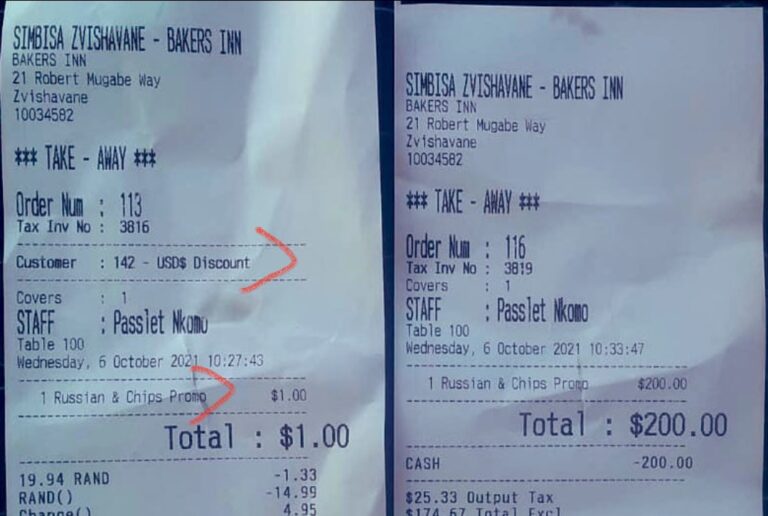
This screenshot has width=768, height=516. What are the coordinates of `table 100` in the screenshot? It's located at (54, 344), (437, 333).